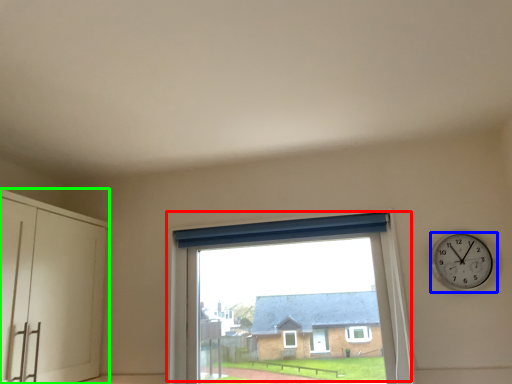
Question: Based on their relative distances, which object is nearer to window (highlighted by a red box)? Choose from wall clock (highlighted by a blue box) and dresser (highlighted by a green box).

Choices:
 (A) wall clock
 (B) dresser

Answer: (A)